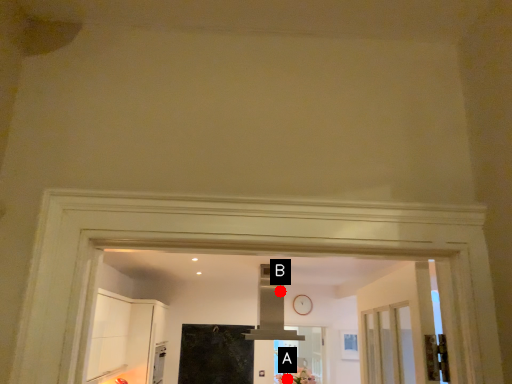
Question: Two points are circled on the image, labeled by A and B beside each circle. Which point appears farthest from the camera in this image?

Choices:
 (A) A is further
 (B) B is further

Answer: (B)